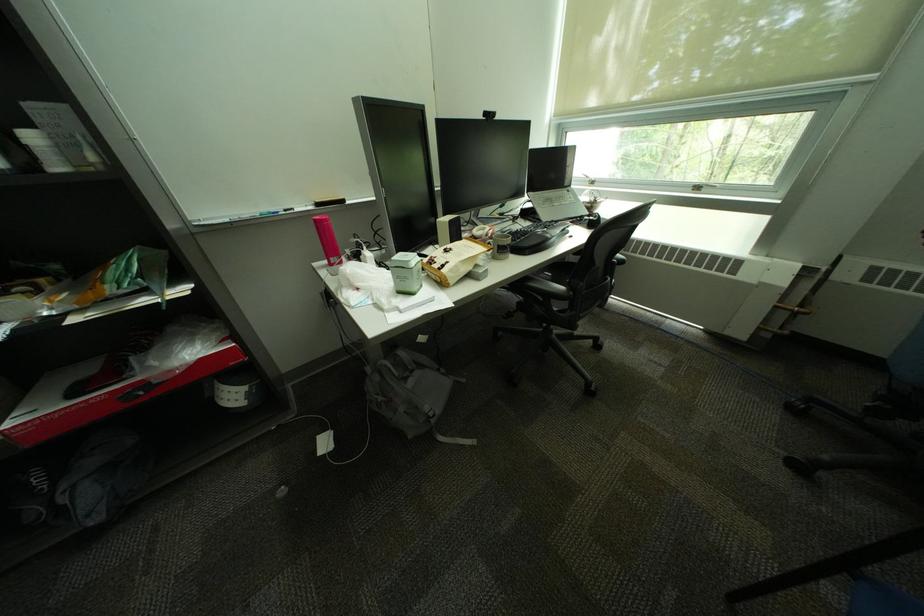
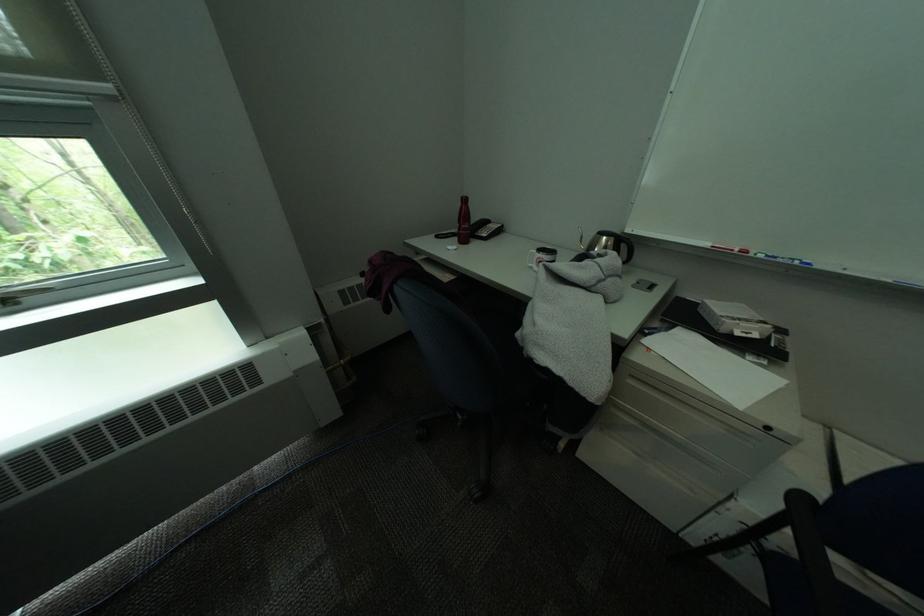
Where in the second image is the point corresponding to pixel 709 190 from the first image?

(15, 302)